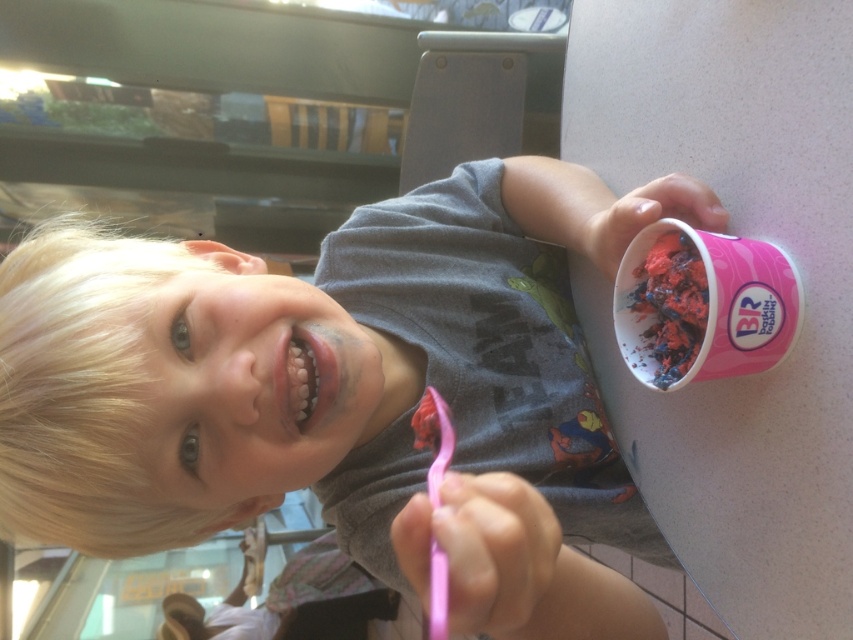
Question: Observing the image, what is the correct spatial positioning of pink matte ice cream cup at right in reference to pink plastic toothbrush at lower center?

Choices:
 (A) below
 (B) above

Answer: (B)

Question: Which object appears farthest from the camera in this image?

Choices:
 (A) pink plastic toothbrush at lower center
 (B) white glossy teeth at center
 (C) pink matte ice cream cup at right

Answer: (B)

Question: Which of the following is the farthest from the observer?

Choices:
 (A) pink matte ice cream cup at right
 (B) pink plastic toothbrush at lower center
 (C) white glossy teeth at center

Answer: (C)

Question: Which of the following is the closest to the observer?

Choices:
 (A) (517, 438)
 (B) (440, 408)
 (C) (331, 369)

Answer: (B)

Question: Can you confirm if pink matte ice cream cup at right is wider than pink plastic toothbrush at lower center?

Choices:
 (A) no
 (B) yes

Answer: (B)

Question: Where is white glossy teeth at center located in relation to pink plastic toothbrush at lower center in the image?

Choices:
 (A) left
 (B) right

Answer: (A)